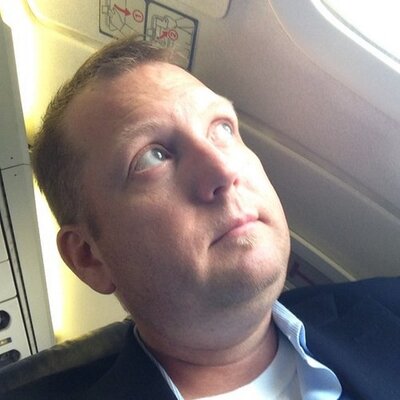
At what (x,y) coordinates should I click in order to perform the action: click on window. Please return your answer as a coordinate pair (x, y). The width and height of the screenshot is (400, 400). Looking at the image, I should click on (366, 20).